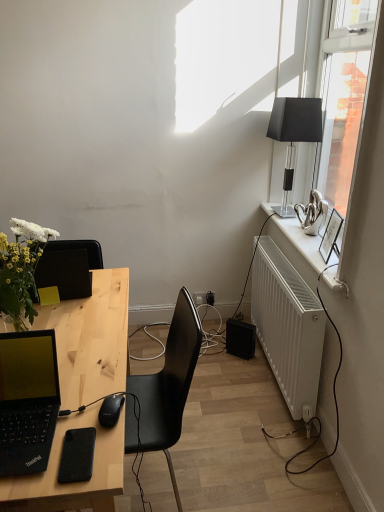
Where is `vacant space that's between black matte mouse at lower left and black matte phone at lower left`? vacant space that's between black matte mouse at lower left and black matte phone at lower left is located at coordinates tap(101, 430).